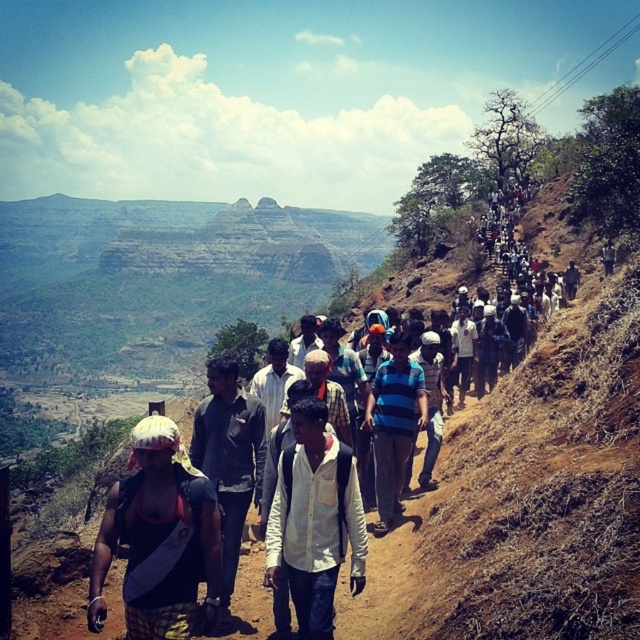
Is dark gray jacket at center to the left of blue striped shirt at center from the viewer's perspective?

Indeed, dark gray jacket at center is positioned on the left side of blue striped shirt at center.

Find the location of `dark gray jacket at center`. dark gray jacket at center is located at coordinates (228, 458).

Who is more distant from viewer, (237, 388) or (381, 408)?

Point (381, 408)

Locate an element on the screen. The image size is (640, 640). dark gray jacket at center is located at coordinates (228, 458).

Can you confirm if reddish-brown backpack at lower left is positioned above white fabric shirt at center?

Incorrect, reddish-brown backpack at lower left is not positioned above white fabric shirt at center.

Which is more to the right, reddish-brown backpack at lower left or white fabric shirt at center?

white fabric shirt at center is more to the right.

Who is more distant from viewer, (209, 486) or (556, 225)?

Positioned behind is point (556, 225).

Where is `reddish-brown backpack at lower left`? The width and height of the screenshot is (640, 640). reddish-brown backpack at lower left is located at coordinates (157, 538).

Measure the distance between white fabric shirt at center and camera.

The distance of white fabric shirt at center from camera is 32.57 meters.

What do you see at coordinates (433, 506) in the screenshot?
I see `white fabric shirt at center` at bounding box center [433, 506].

Identify the location of white fabric shirt at center. (433, 506).